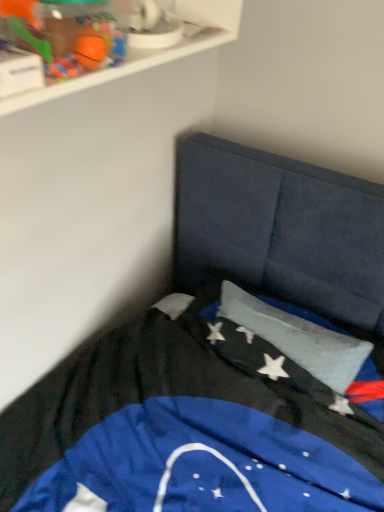
What do you see at coordinates (146, 53) in the screenshot? This screenshot has width=384, height=512. I see `white plastic shelf at upper left` at bounding box center [146, 53].

Find the location of a particular element. rubberized orange ball at upper left is located at coordinates (66, 33).

Are white plastic shelf at upper left and rubberized orange ball at upper left making contact?

white plastic shelf at upper left and rubberized orange ball at upper left are clearly separated.

Is white plastic shelf at upper left shorter than rubberized orange ball at upper left?

In fact, white plastic shelf at upper left may be taller than rubberized orange ball at upper left.

You are a GUI agent. You are given a task and a screenshot of the screen. Output one action in this format:
    pyautogui.click(x=<x>, y=<y>)
    Task: Click on the toy to the left of white plastic shelf at upper left
    The height and width of the screenshot is (512, 384).
    Given the screenshot: What is the action you would take?
    pyautogui.click(x=66, y=33)

Based on their positions, is silky blue flag at center located to the left or right of white plastic shelf at upper left?

→ silky blue flag at center is positioned on white plastic shelf at upper left's right side.

Is silky blue flag at center bigger than white plastic shelf at upper left?

Indeed, silky blue flag at center has a larger size compared to white plastic shelf at upper left.

Is silky blue flag at center looking in the opposite direction of white plastic shelf at upper left?

No, silky blue flag at center's orientation is not away from white plastic shelf at upper left.

Considering the positions of objects silky blue flag at center and rubberized orange ball at upper left in the image provided, who is behind, silky blue flag at center or rubberized orange ball at upper left?

silky blue flag at center.

Is silky blue flag at center beside rubberized orange ball at upper left?

There is a gap between silky blue flag at center and rubberized orange ball at upper left.

Considering the relative sizes of rubberized orange ball at upper left and white plastic shelf at upper left in the image provided, is rubberized orange ball at upper left taller than white plastic shelf at upper left?

No, rubberized orange ball at upper left is not taller than white plastic shelf at upper left.

From a real-world perspective, which object stands above the other?

rubberized orange ball at upper left is physically above.

Does rubberized orange ball at upper left turn towards white plastic shelf at upper left?

Yes, rubberized orange ball at upper left is turned towards white plastic shelf at upper left.

Is rubberized orange ball at upper left next to white plastic shelf at upper left?

They are not placed beside each other.

How different are the orientations of white plastic shelf at upper left and silky blue flag at center in degrees?

The angular difference between white plastic shelf at upper left and silky blue flag at center is 82.1 degrees.

From the image's perspective, which one is positioned lower, white plastic shelf at upper left or silky blue flag at center?

silky blue flag at center.

Which is further, (14,111) or (332,360)?

The point (332,360) is behind.

Can you confirm if white plastic shelf at upper left is taller than silky blue flag at center?

No, white plastic shelf at upper left is not taller than silky blue flag at center.

Is rubberized orange ball at upper left facing towards silky blue flag at center?

No, rubberized orange ball at upper left is not aimed at silky blue flag at center.

Is rubberized orange ball at upper left placed right next to silky blue flag at center?

No, rubberized orange ball at upper left is not making contact with silky blue flag at center.

In the scene shown: Which is more to the right, rubberized orange ball at upper left or silky blue flag at center?

silky blue flag at center.

Locate an element on the screen. The height and width of the screenshot is (512, 384). shelf on the right of the rubberized orange ball at upper left is located at coordinates (146, 53).

Find the location of a particular element. flag below the white plastic shelf at upper left (from the image's perspective) is located at coordinates (298, 337).

From the image, which object appears to be nearer to white plastic shelf at upper left, rubberized orange ball at upper left or silky blue flag at center?

Based on the image, rubberized orange ball at upper left appears to be nearer to white plastic shelf at upper left.

Based on the photo, which object lies nearer to the anchor point silky blue flag at center, white plastic shelf at upper left or rubberized orange ball at upper left?

The object closer to silky blue flag at center is white plastic shelf at upper left.

Consider the image. Based on their spatial positions, is rubberized orange ball at upper left or white plastic shelf at upper left closer to silky blue flag at center?

The object closer to silky blue flag at center is white plastic shelf at upper left.

When comparing their distances from white plastic shelf at upper left, does silky blue flag at center or rubberized orange ball at upper left seem further?

silky blue flag at center is positioned further to the anchor white plastic shelf at upper left.

From the image, which object appears to be nearer to rubberized orange ball at upper left, white plastic shelf at upper left or silky blue flag at center?

white plastic shelf at upper left is positioned closer to the anchor rubberized orange ball at upper left.

From the image, which object appears to be farther from rubberized orange ball at upper left, silky blue flag at center or white plastic shelf at upper left?

Among the two, silky blue flag at center is located further to rubberized orange ball at upper left.

Locate an element on the screen. Image resolution: width=384 pixels, height=512 pixels. toy that lies between white plastic shelf at upper left and silky blue flag at center from top to bottom is located at coordinates (66, 33).